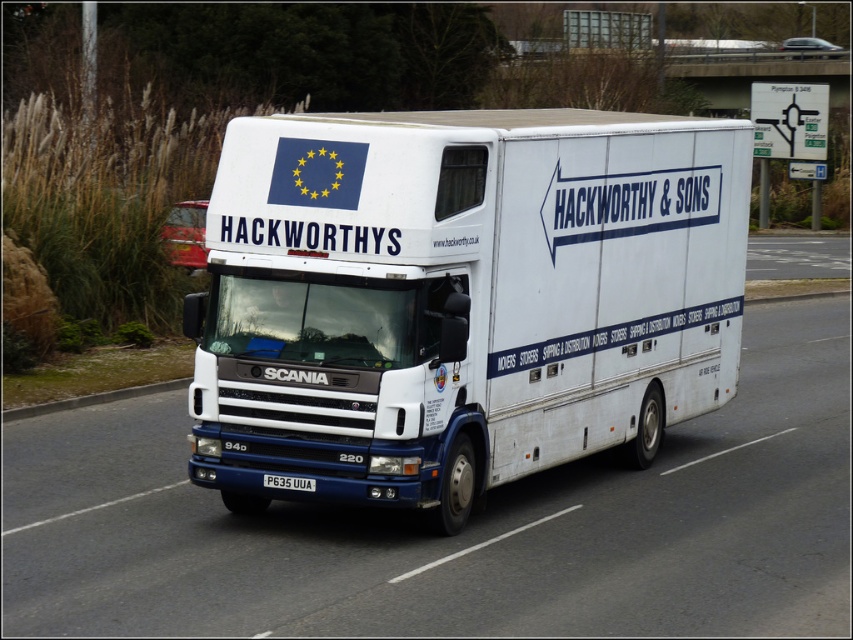
Question: Does white glossy truck at center have a larger size compared to white plastic license plate at center?

Choices:
 (A) yes
 (B) no

Answer: (A)

Question: Based on their relative distances, which object is farther from the white matte trailer truck at center?

Choices:
 (A) white glossy truck at center
 (B) white plastic license plate at center

Answer: (A)

Question: Considering the real-world distances, which object is farthest from the white glossy truck at center?

Choices:
 (A) white plastic license plate at center
 (B) white matte trailer truck at center

Answer: (B)

Question: Is white glossy truck at center thinner than white plastic license plate at center?

Choices:
 (A) yes
 (B) no

Answer: (B)

Question: Among these objects, which one is nearest to the camera?

Choices:
 (A) white matte trailer truck at center
 (B) white plastic license plate at center
 (C) white glossy truck at center

Answer: (C)

Question: Is white matte trailer truck at center further to camera compared to white plastic license plate at center?

Choices:
 (A) no
 (B) yes

Answer: (B)